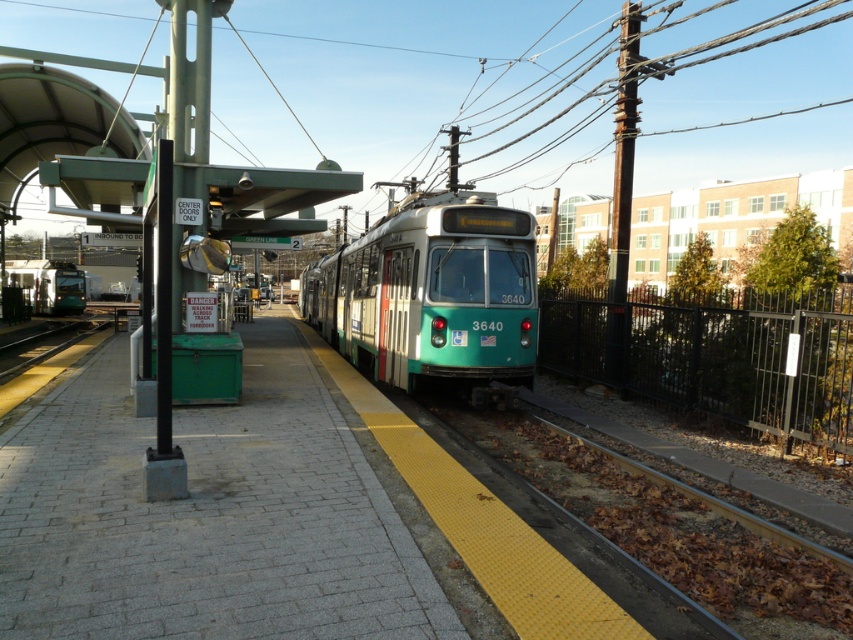
You are a passenger waiting on the brick platform at center. You need to board the green matte train at left. Based on their sizes, which object takes up more space in the image?

The green matte train at left takes up more space in the image because the brick platform at center occupies less space than the green matte train at left.